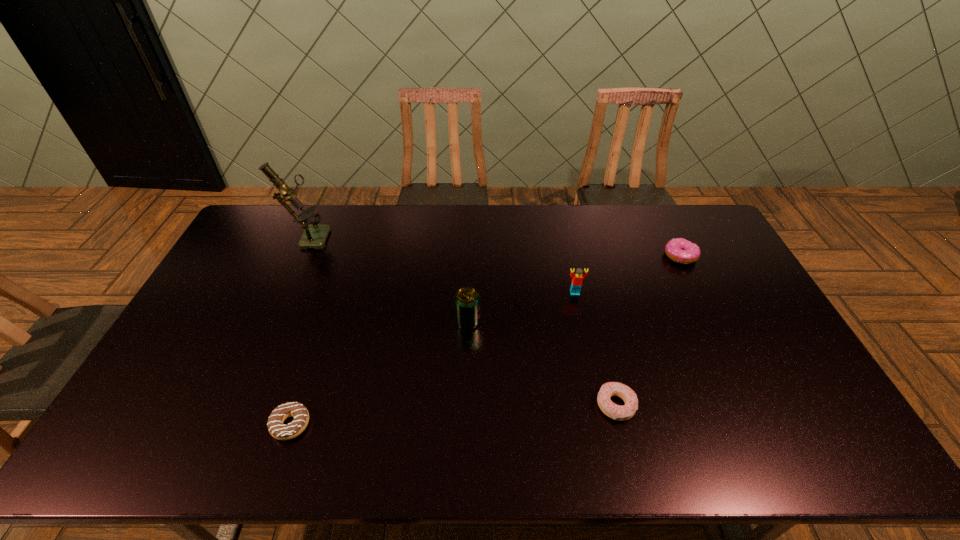
This screenshot has width=960, height=540. Find the location of `free space at the left edge of the desktop`. free space at the left edge of the desktop is located at coordinates (177, 353).

The width and height of the screenshot is (960, 540). I want to click on vacant area at the right edge, so click(x=812, y=399).

Locate an element on the screen. free space at the far left corner of the desktop is located at coordinates (262, 206).

The height and width of the screenshot is (540, 960). Find the location of `vacant space at the far right corner of the desktop`. vacant space at the far right corner of the desktop is located at coordinates (697, 208).

Find the location of `blank region between the fourth farthest object and the fourth nearest object`. blank region between the fourth farthest object and the fourth nearest object is located at coordinates (521, 307).

Where is `blank region between the second doughnut from right to left and the rightmost doughnut`? This screenshot has height=540, width=960. blank region between the second doughnut from right to left and the rightmost doughnut is located at coordinates (648, 330).

Image resolution: width=960 pixels, height=540 pixels. I want to click on free point between the microscope and the rightmost object, so click(494, 246).

Identify the location of vacant area that lies between the third nearest object and the tallest object. The image size is (960, 540). (388, 278).

This screenshot has width=960, height=540. I want to click on vacant space in between the second object from left to right and the second doughnut from left to right, so (x=453, y=415).

This screenshot has width=960, height=540. Find the location of `vacant area between the rightmost object and the microscope`. vacant area between the rightmost object and the microscope is located at coordinates (494, 246).